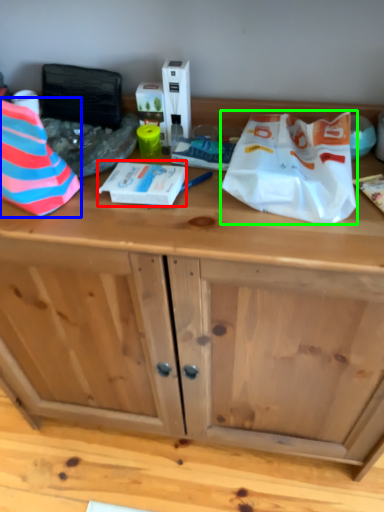
Question: Estimate the real-world distances between objects in this image. Which object is closer to wrapping paper (highlighted by a red box), wrapping paper (highlighted by a blue box) or wrapping paper (highlighted by a green box)?

Choices:
 (A) wrapping paper
 (B) wrapping paper

Answer: (A)